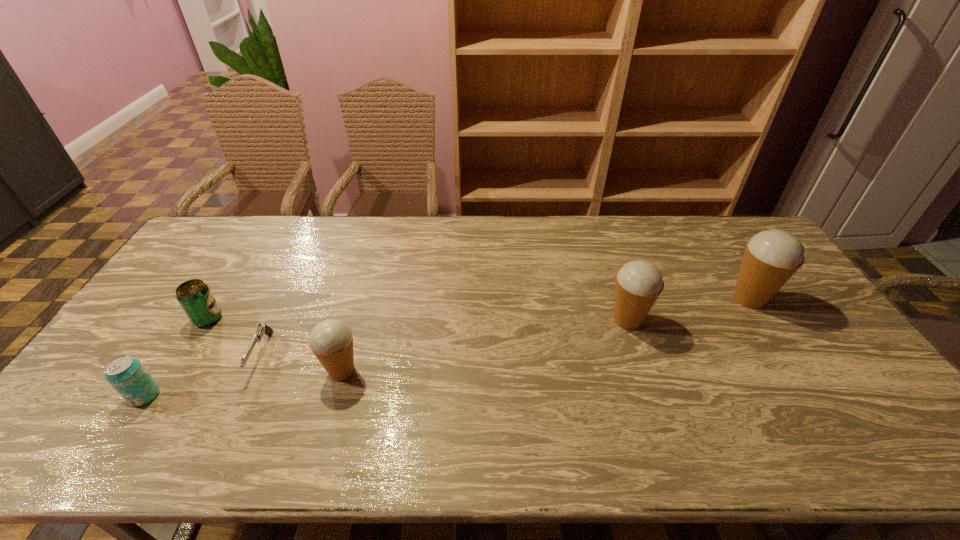
Locate an element on the screen. This screenshot has height=540, width=960. the nearest icecream is located at coordinates click(x=331, y=340).

The width and height of the screenshot is (960, 540). I want to click on the fourth shortest object, so click(331, 340).

Identify the location of the fifth object from left to right. (638, 284).

Where is `the second icecream from left to right`? the second icecream from left to right is located at coordinates (638, 284).

I want to click on the rightmost object, so click(x=771, y=257).

Where is `the farther beer can`? Image resolution: width=960 pixels, height=540 pixels. the farther beer can is located at coordinates (194, 296).

The image size is (960, 540). I want to click on pistol, so click(262, 330).

Locate an element on the screen. This screenshot has height=540, width=960. the shortest object is located at coordinates (262, 330).

What are the coordinates of `the nearer beer can` in the screenshot? It's located at (127, 375).

Image resolution: width=960 pixels, height=540 pixels. In order to click on vacant space located on the right of the nearest icecream in this screenshot , I will do `click(430, 371)`.